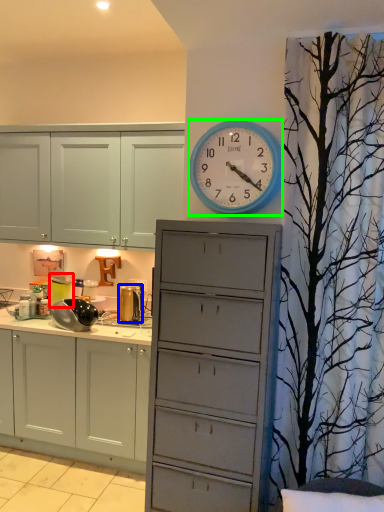
Question: Which object is the farthest from appliance (highlighted by a red box)? Choose among these: appliance (highlighted by a blue box) or wall clock (highlighted by a green box).

Choices:
 (A) appliance
 (B) wall clock

Answer: (B)